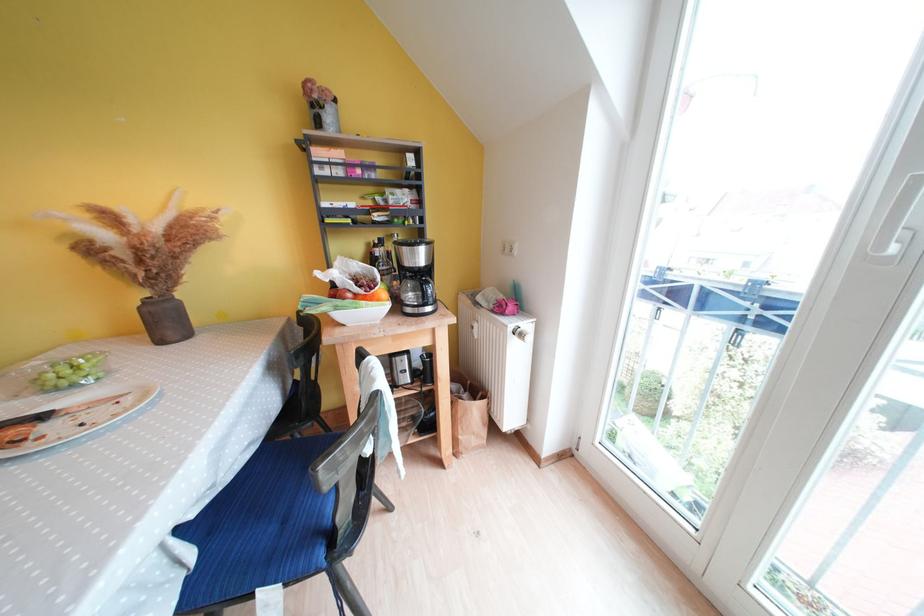
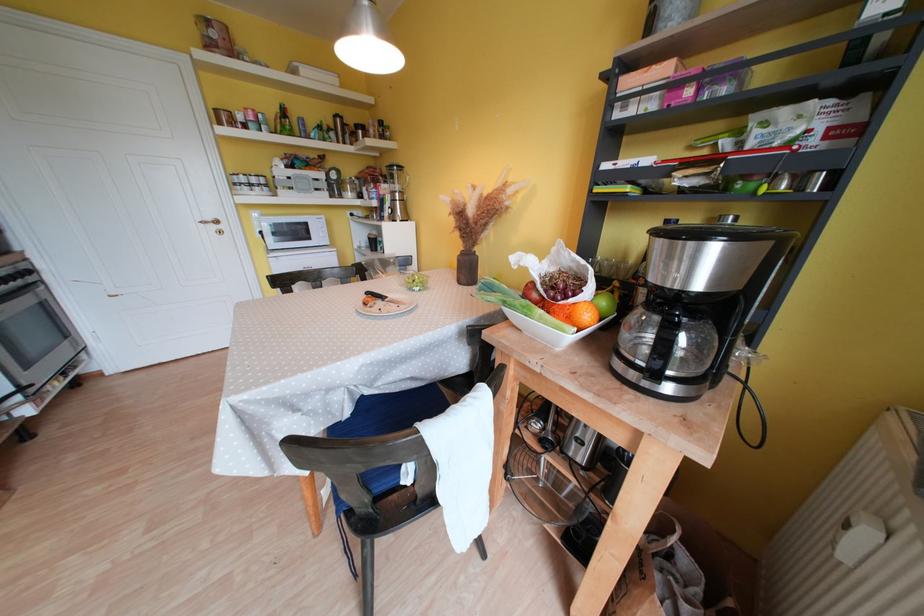
Where in the second image is the point corresponding to (482,341) from the first image?

(850, 562)